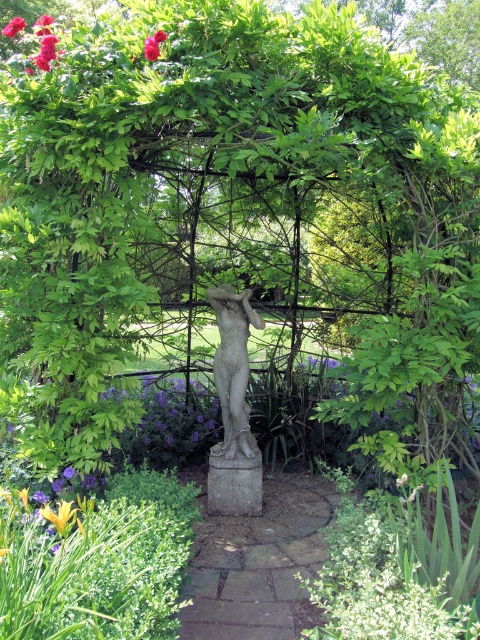
Question: Considering the real-world distances, which object is farthest from the bright pink petals at upper left?

Choices:
 (A) white marble statue at center
 (B) purple matte flower at lower left
 (C) red matte flower at upper left

Answer: (B)

Question: Is purple matte flower at center smaller than purple matte flower at lower left?

Choices:
 (A) yes
 (B) no

Answer: (B)

Question: Is brown stone path at center bigger than red matte flower at upper left?

Choices:
 (A) yes
 (B) no

Answer: (A)

Question: Can you confirm if brown stone path at center is positioned below white marble statue at center?

Choices:
 (A) no
 (B) yes

Answer: (B)

Question: Which point is farther to the camera?

Choices:
 (A) click(x=22, y=22)
 (B) click(x=193, y=541)

Answer: (B)

Question: Which object is positioned farthest from the red matte flower at upper left?

Choices:
 (A) purple matte flower at lower left
 (B) brown stone path at center

Answer: (B)